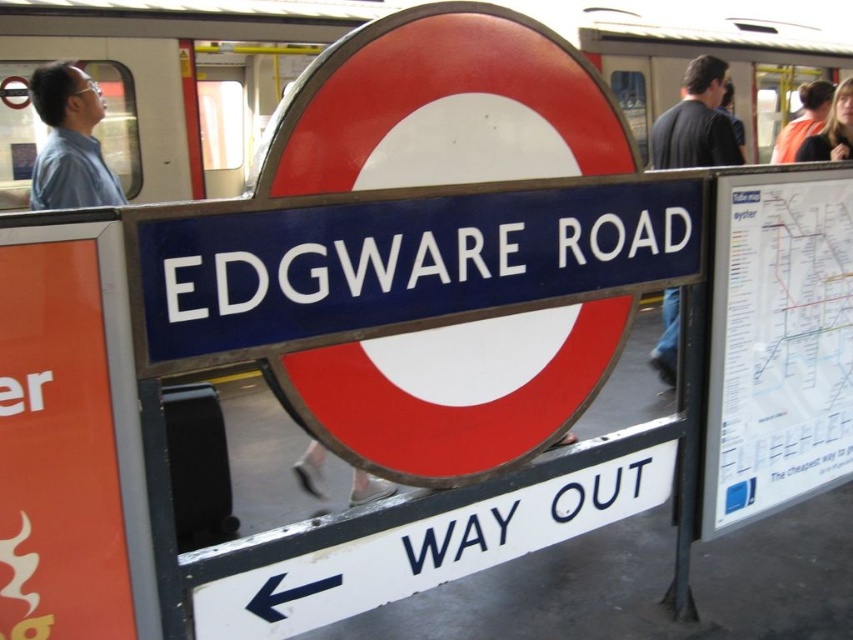
You are a passenger on the platform at Edgware Road station. You notice two people nearby wearing different clothing items. Which person is standing closer to the train doors? The black shirt at right or the orange safety vest at upper right?

The black shirt at right is taller than the orange safety vest at upper right, so the orange safety vest at upper right is closer to the train doors since it is shorter and positioned higher up.